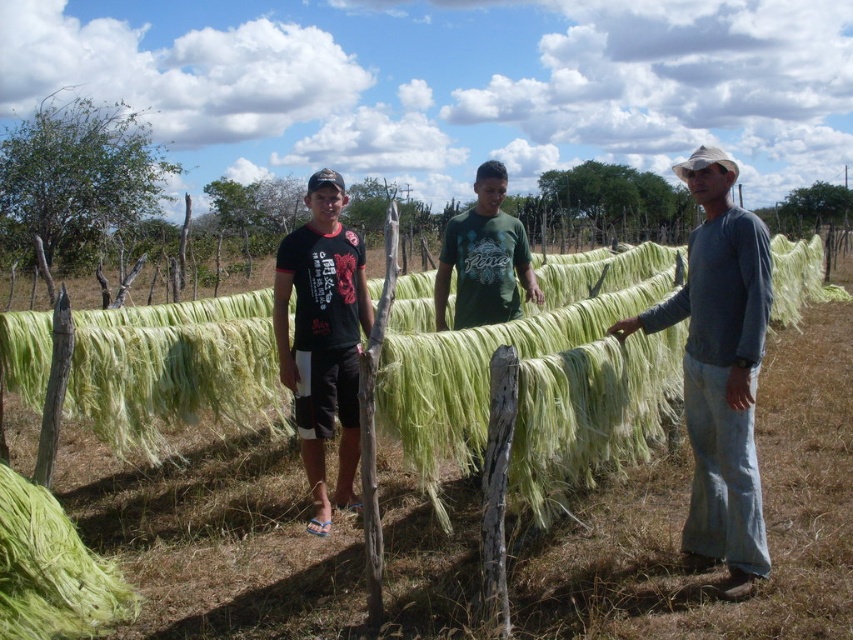
You are a farmer who wants to place a new scarecrow in the middle of the green fabric at center and the green fibrous hay at lower left. Which object should you place the scarecrow on top of to ensure it stays above both?

You should place the scarecrow on top of the green fabric at center because it is already positioned over the green fibrous hay at lower left, ensuring the scarecrow remains above both.

You are planning to take a photo of the green leafy tree at left and the green matte shirt at center. Since both are green, will the tree be more noticeable than the shirt in the photo?

The green leafy tree at left has a larger size compared to green matte shirt at center, so the tree will be more noticeable in the photo due to its bigger size.

You are planning to plant a new tree in this area. Considering the space occupied by the green leafy tree at left and the green matte shirt at center, which object takes up more horizontal space?

The green leafy tree at left takes up more horizontal space than the green matte shirt at center because its width is larger.